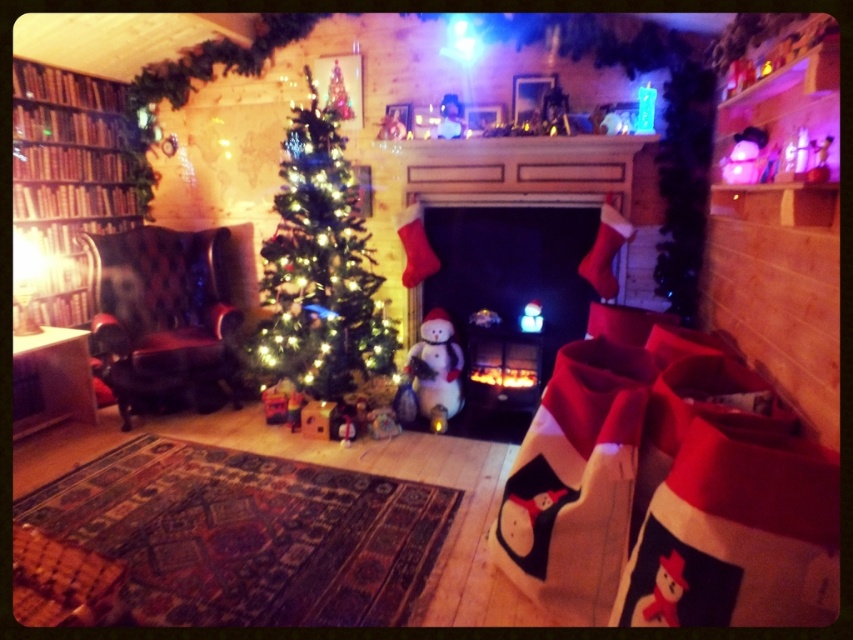
Between green matte christmas tree at center and wooden bookshelf at left, which one has more height?

With more height is green matte christmas tree at center.

Who is lower down, green matte christmas tree at center or wooden bookshelf at left?

green matte christmas tree at center

Who is more distant from viewer, (310,141) or (99,140)?

The point (99,140) is behind.

This screenshot has height=640, width=853. In order to click on green matte christmas tree at center in this screenshot , I will do `click(320, 266)`.

Is black glossy fireplace at center above wooden bookshelf at left?

Actually, black glossy fireplace at center is below wooden bookshelf at left.

Is point (534, 362) less distant than point (79, 192)?

Yes.

Image resolution: width=853 pixels, height=640 pixels. What are the coordinates of `black glossy fireplace at center` in the screenshot? It's located at (509, 292).

Who is lower down, black glossy fireplace at center or leather wingback chair at left?

leather wingback chair at left is lower down.

How distant is black glossy fireplace at center from leather wingback chair at left?

black glossy fireplace at center and leather wingback chair at left are 5.06 feet apart.

Which is in front, point (592, 230) or point (103, 259)?

Point (592, 230) is more forward.

At what (x,y) coordinates should I click in order to perform the action: click on black glossy fireplace at center. Please return your answer as a coordinate pair (x, y). The width and height of the screenshot is (853, 640). Looking at the image, I should click on pyautogui.click(x=509, y=292).